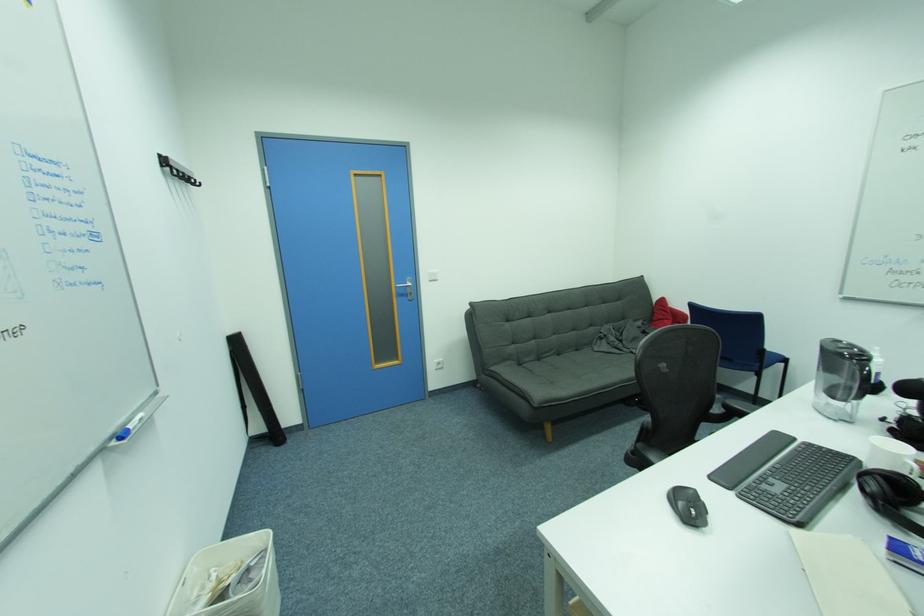
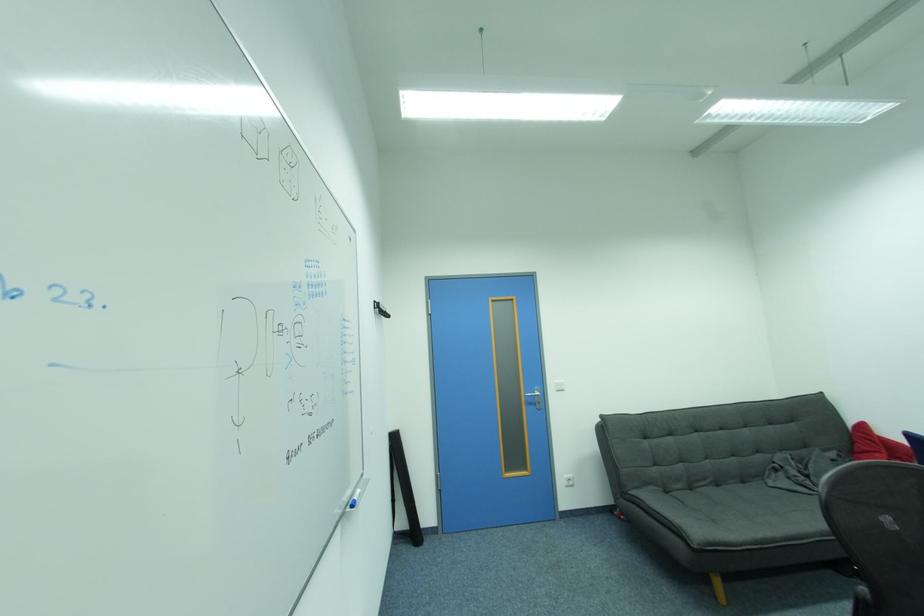
Where in the second image is the point corresponding to (565,355) from the first image?

(723, 487)